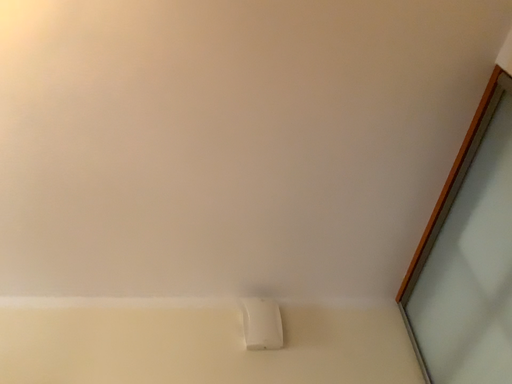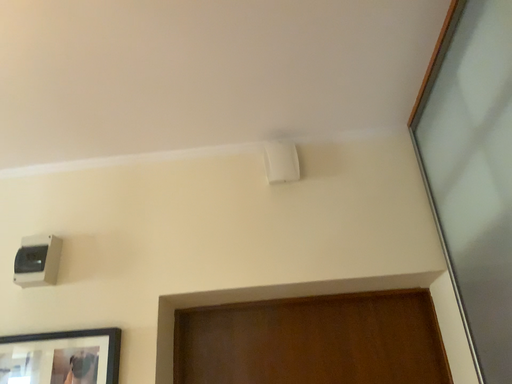
Question: Which way did the camera rotate in the video?

Choices:
 (A) rotated upward
 (B) rotated downward

Answer: (B)